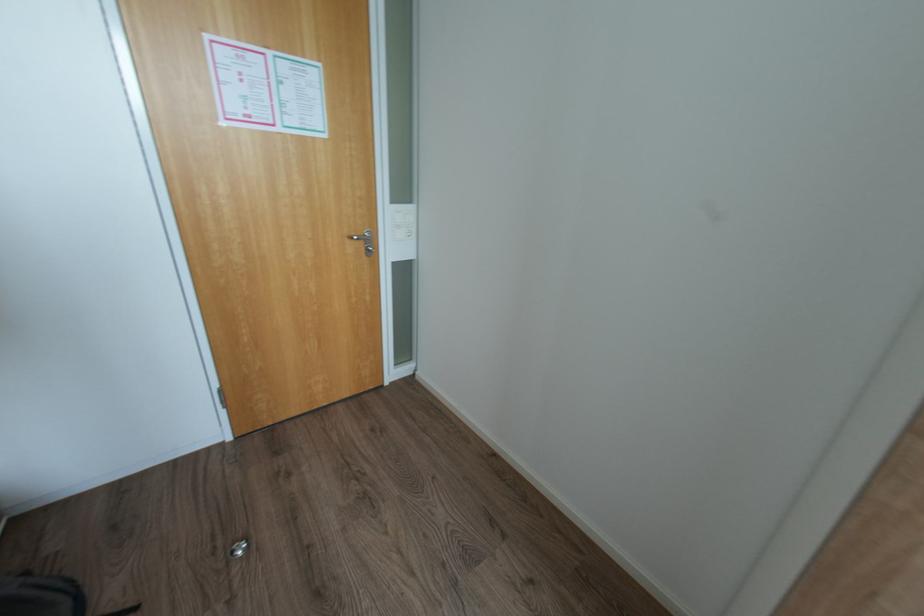
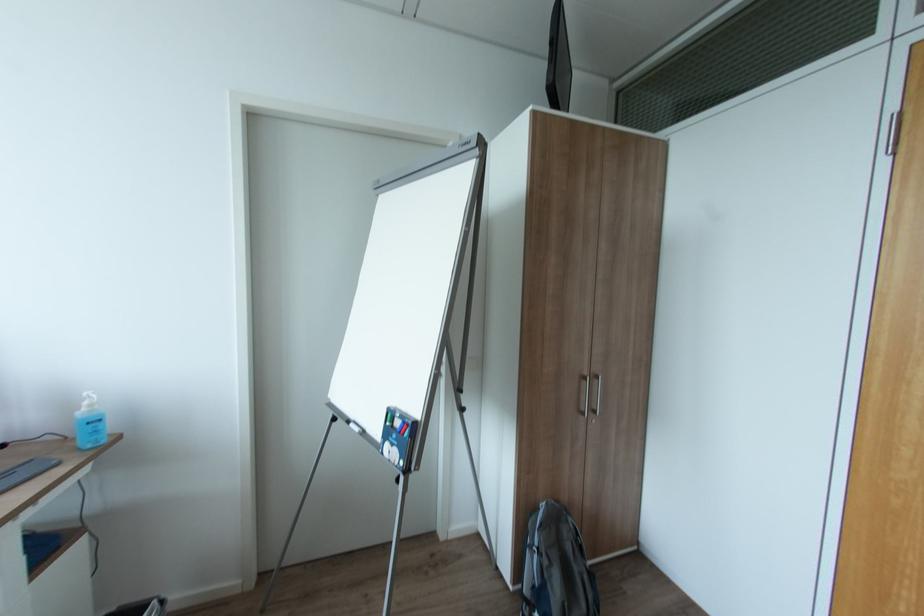
Question: The camera is either moving clockwise (left) or counter-clockwise (right) around the object. The first image is from the beginning of the video and the second image is from the end. Is the camera moving left or right when shooting the video?

Choices:
 (A) Left
 (B) Right

Answer: (B)